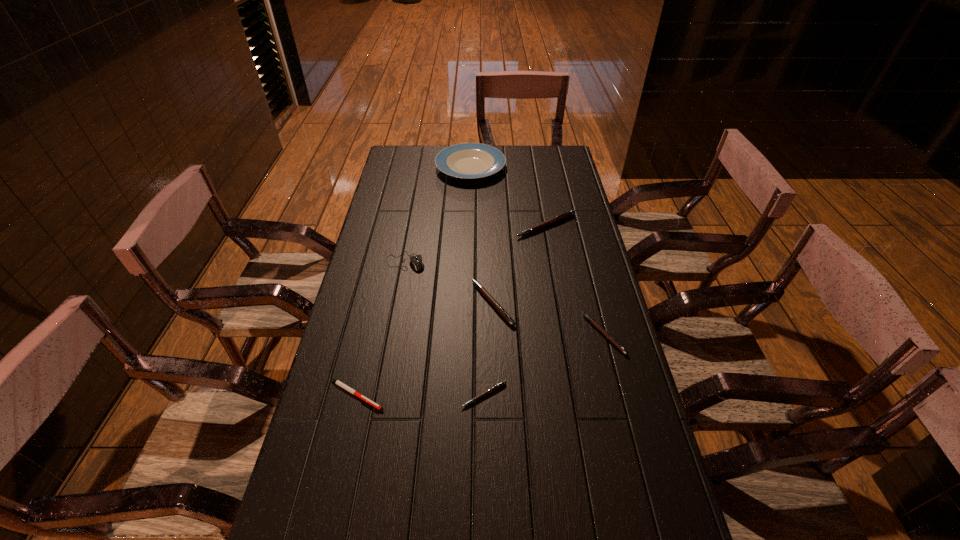
Locate an element on the screen. free point between the farthest object and the third shortest pen is located at coordinates (537, 251).

Locate an element on the screen. The image size is (960, 540). free space that is in between the third farthest object and the fourth shortest object is located at coordinates (449, 282).

The width and height of the screenshot is (960, 540). What are the coordinates of `empty location between the biggest pink pen and the nearest pink pen` in the screenshot? It's located at (515, 310).

Where is `vacant area that lies between the white pen and the blue plate`? This screenshot has width=960, height=540. vacant area that lies between the white pen and the blue plate is located at coordinates (414, 281).

Where is `vacant point located between the leftmost pen and the third smallest pink pen`? The height and width of the screenshot is (540, 960). vacant point located between the leftmost pen and the third smallest pink pen is located at coordinates (424, 349).

This screenshot has height=540, width=960. Identify the location of free space between the second tallest pen and the white pen. (424, 349).

Identify which object is the second nearest to the plate. Please provide its 2D coordinates. Your answer should be formatted as a tuple, i.e. [(x, y)], where the tuple contains the x and y coordinates of a point satisfying the conditions above.

[(416, 260)]

Select which object is the third closest to the leftmost pen. Please provide its 2D coordinates. Your answer should be formatted as a tuple, i.e. [(x, y)], where the tuple contains the x and y coordinates of a point satisfying the conditions above.

[(416, 260)]

At what (x,y) coordinates should I click in order to perform the action: click on the second closest pen to the plate. Please return your answer as a coordinate pair (x, y). This screenshot has width=960, height=540. Looking at the image, I should click on (497, 306).

The image size is (960, 540). In order to click on pen that stands as the third closest to the smallest pink pen in this screenshot , I will do `click(593, 322)`.